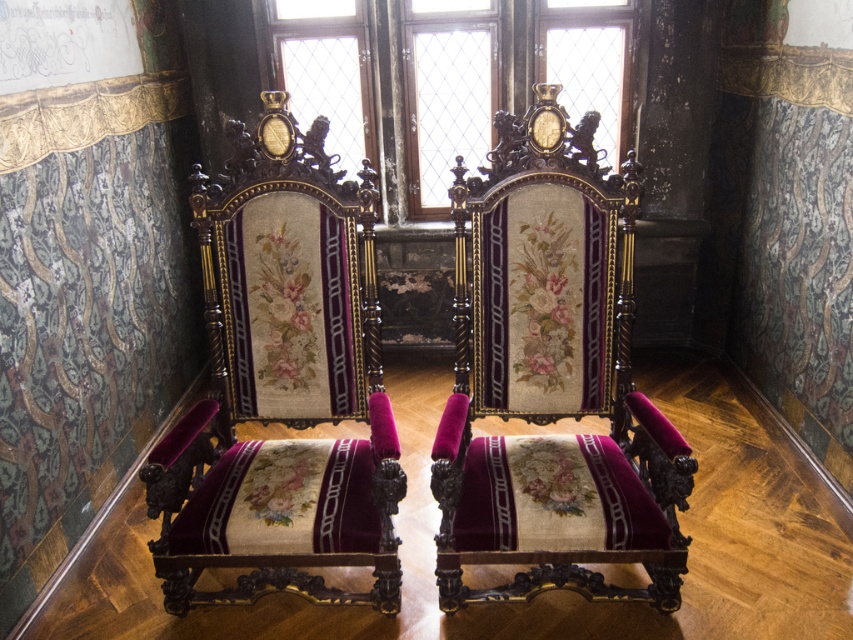
Question: Which object is the closest to the clear glass window at upper center?

Choices:
 (A) clear glass window at center
 (B) velvetmatte black armchair at center

Answer: (A)

Question: Is velvetmatte black armchair at center further to camera compared to matte wood window at center?

Choices:
 (A) yes
 (B) no

Answer: (B)

Question: Which object is closer to the camera taking this photo?

Choices:
 (A) clear glass window at upper center
 (B) velvetmatte black armchair at center
 (C) velvetvelvetarmchair at left
 (D) clear glass window at center

Answer: (B)

Question: Does velvetmatte black armchair at center have a smaller size compared to clear glass window at center?

Choices:
 (A) yes
 (B) no

Answer: (A)

Question: Estimate the real-world distances between objects in this image. Which object is farther from the velvetvelvetarmchair at left?

Choices:
 (A) clear glass window at center
 (B) clear glass window at upper center

Answer: (B)

Question: Is clear glass window at center below matte wood window at center?

Choices:
 (A) no
 (B) yes

Answer: (B)